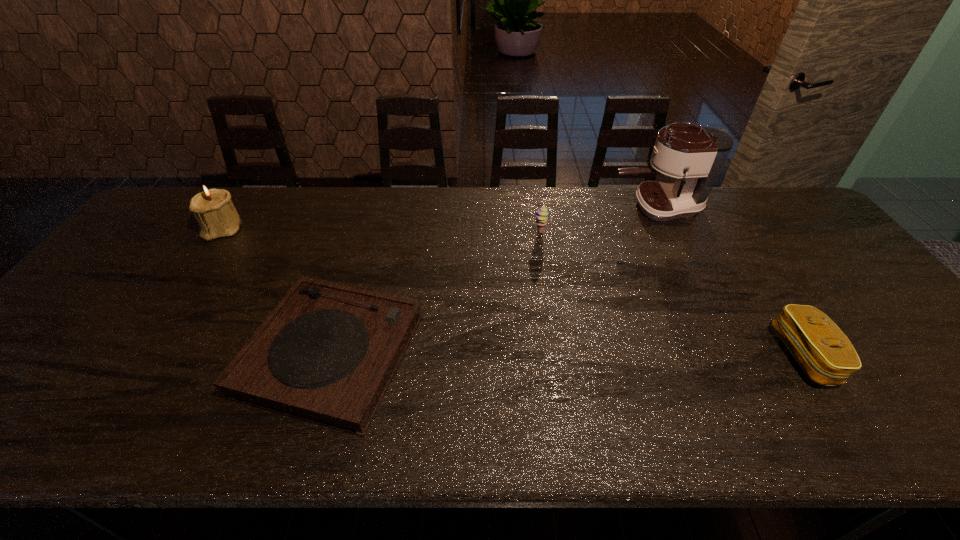
Where is `vacant space located on the back of the leftmost object`? This screenshot has width=960, height=540. vacant space located on the back of the leftmost object is located at coordinates tap(246, 197).

This screenshot has height=540, width=960. Find the location of `free location located 0.290m on the front of the sherbert`. free location located 0.290m on the front of the sherbert is located at coordinates (552, 306).

Identify the location of free space located 0.210m on the zipper side of the clutch bag. The image size is (960, 540). (691, 356).

Where is `vacant space situated 0.300m on the zipper side of the clutch bag`? The height and width of the screenshot is (540, 960). vacant space situated 0.300m on the zipper side of the clutch bag is located at coordinates pos(653,356).

You are a GUI agent. You are given a task and a screenshot of the screen. Output one action in this format:
    pyautogui.click(x=<x>, y=<y>)
    Task: Click on the blank space located 0.090m on the zipper side of the clutch bag
    This screenshot has height=540, width=960.
    Given the screenshot: What is the action you would take?
    pyautogui.click(x=743, y=356)

Where is `vacant space located 0.080m on the back of the shortest object`? This screenshot has height=540, width=960. vacant space located 0.080m on the back of the shortest object is located at coordinates (355, 271).

This screenshot has width=960, height=540. In order to click on coffee maker present at the far edge in this screenshot , I will do `click(694, 155)`.

Identify the location of candle_holder situated at the far edge. The image size is (960, 540). (213, 210).

I want to click on sherbert that is at the far edge, so click(x=541, y=215).

Locate an element on the screen. object at the near edge is located at coordinates (327, 353).